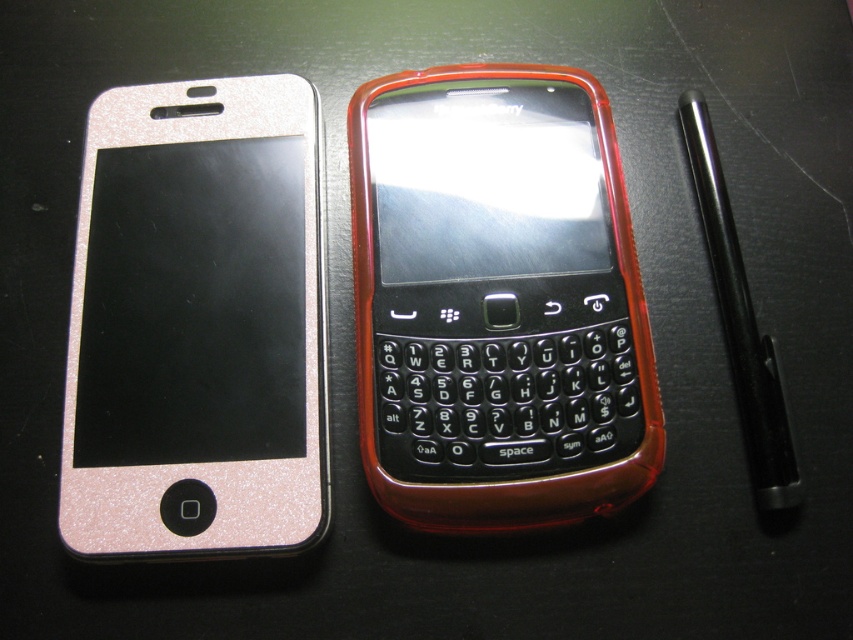
Question: Which object is the closest to the translucent red plastic blackberry at center?

Choices:
 (A) glittery rose gold phone at left
 (B) black metallic pen at right

Answer: (A)

Question: Can you confirm if translucent red plastic blackberry at center is positioned below black metallic pen at right?

Choices:
 (A) no
 (B) yes

Answer: (A)

Question: Does translucent red plastic blackberry at center appear on the right side of black metallic pen at right?

Choices:
 (A) yes
 (B) no

Answer: (B)

Question: Among these objects, which one is farthest from the camera?

Choices:
 (A) translucent red plastic blackberry at center
 (B) black metallic pen at right
 (C) glittery rose gold phone at left

Answer: (A)

Question: Does glittery rose gold phone at left come in front of black metallic pen at right?

Choices:
 (A) yes
 (B) no

Answer: (A)

Question: Which of these objects is positioned closest to the glittery rose gold phone at left?

Choices:
 (A) translucent red plastic blackberry at center
 (B) black metallic pen at right

Answer: (A)